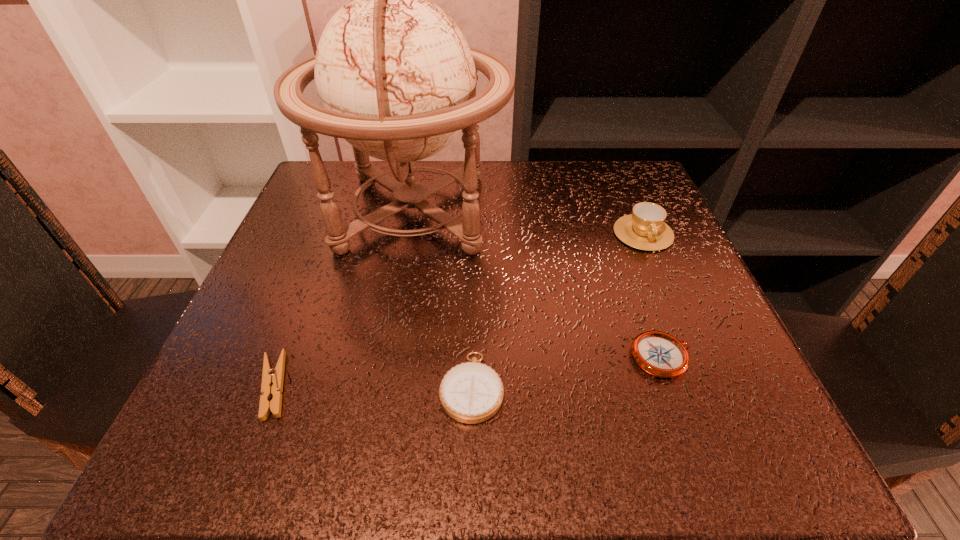
Image resolution: width=960 pixels, height=540 pixels. What are the coordinates of `free space between the cup and the globe` in the screenshot? It's located at (528, 222).

I want to click on free spot between the left compass and the cup, so click(558, 310).

The height and width of the screenshot is (540, 960). Identify the location of unoccupied position between the globe and the right compass. (538, 284).

Where is `vacant space that's between the tallest object and the left compass`? The image size is (960, 540). vacant space that's between the tallest object and the left compass is located at coordinates (443, 299).

The width and height of the screenshot is (960, 540). I want to click on free space between the globe and the left compass, so click(x=443, y=299).

This screenshot has height=540, width=960. I want to click on free point between the right compass and the left compass, so click(567, 372).

Choose which object is the nearest neighbor to the right compass. Please provide its 2D coordinates. Your answer should be formatted as a tuple, i.e. [(x, y)], where the tuple contains the x and y coordinates of a point satisfying the conditions above.

[(472, 392)]

Point out which object is positioned as the fourth nearest to the right compass. Please provide its 2D coordinates. Your answer should be formatted as a tuple, i.e. [(x, y)], where the tuple contains the x and y coordinates of a point satisfying the conditions above.

[(272, 379)]

Where is `blank space that satisfies the following two spatial constraints: 1. on the back side of the left compass; 2. at the front of the globe showing Africa`? The image size is (960, 540). blank space that satisfies the following two spatial constraints: 1. on the back side of the left compass; 2. at the front of the globe showing Africa is located at coordinates (474, 212).

Image resolution: width=960 pixels, height=540 pixels. I want to click on free space that satisfies the following two spatial constraints: 1. on the back side of the shortest object; 2. on the right side of the right compass, so click(x=285, y=357).